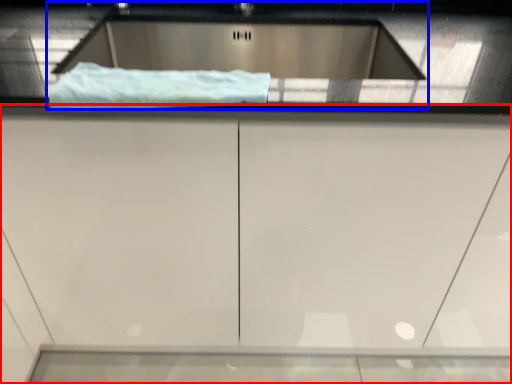
Question: Which object appears closest to the camera in this image, cabinetry (highlighted by a red box) or sink (highlighted by a blue box)?

Choices:
 (A) cabinetry
 (B) sink

Answer: (A)